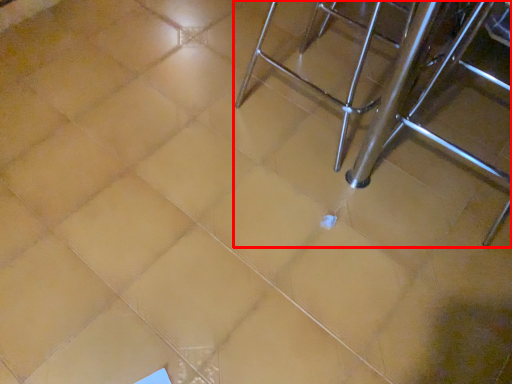
Question: In this image, where is furniture (annotated by the red box) located relative to chair?

Choices:
 (A) right
 (B) left

Answer: (A)